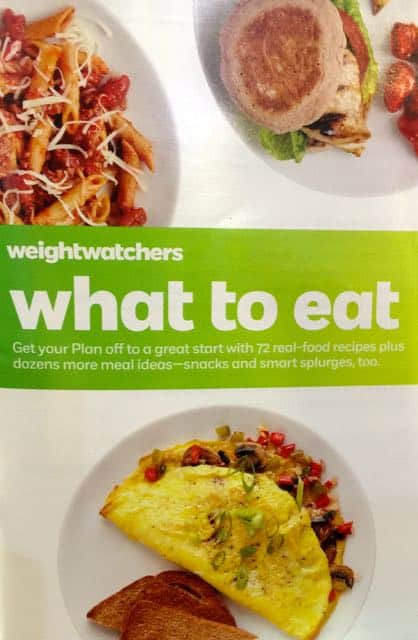
This screenshot has height=640, width=418. In order to click on white plate in this screenshot , I will do `click(361, 509)`.